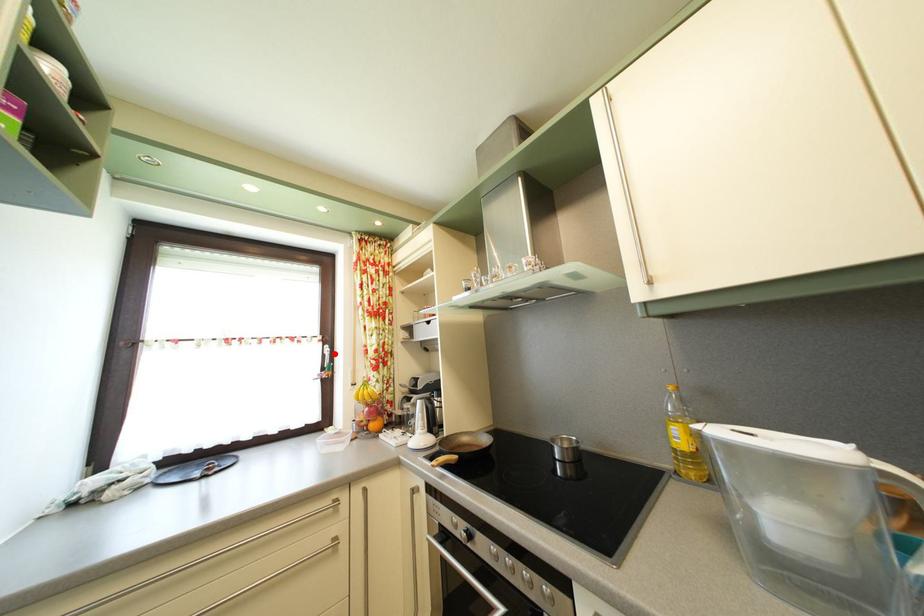
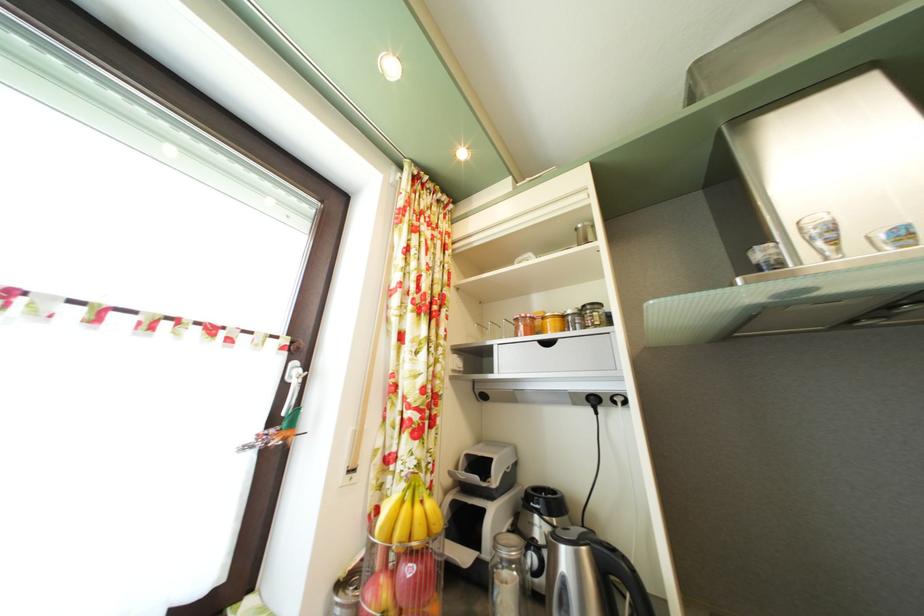
Locate, in the second image, the point that corresponds to the highlighted location in the first image.

(304, 371)